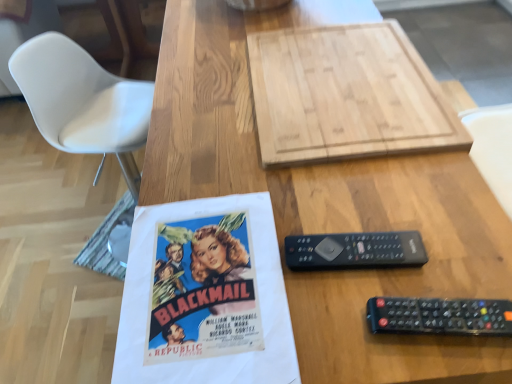
I want to click on vacant space to the right of black plastic remote at right, so click(442, 234).